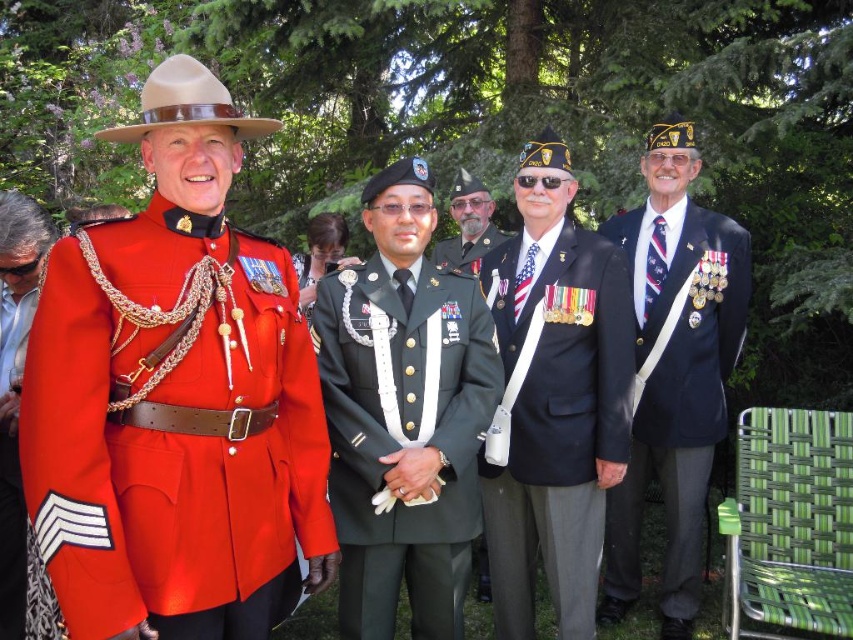
What is the location of the point with coordinates (10, 532) in the image?

The point with coordinates (10, 532) is located on the shiny red fabric at left.